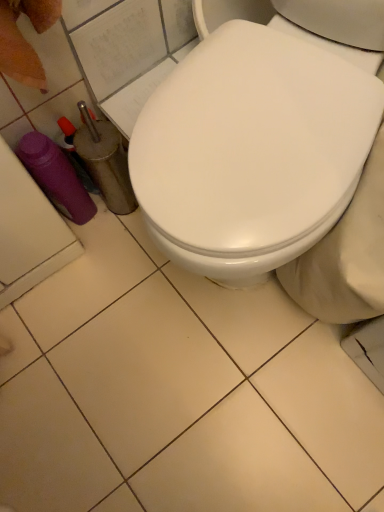
Locate an element on the screen. white glossy toilet at center is located at coordinates (251, 150).

Between white glossy toilet seat at center and white glossy toilet at center, which one appears on the left side from the viewer's perspective?

white glossy toilet at center is more to the left.

Can you confirm if white glossy toilet seat at center is shorter than white glossy toilet at center?

Yes.

What's the angular difference between white glossy toilet seat at center and white glossy toilet at center's facing directions?

There is a 0.000155-degree angle between the facing directions of white glossy toilet seat at center and white glossy toilet at center.

From a real-world perspective, is white glossy toilet seat at center over white glossy toilet at center?

No, from a real-world perspective, white glossy toilet seat at center is not on top of white glossy toilet at center.

Considering the relative sizes of white glossy toilet at center and purple plastic bottle at lower left in the image provided, is white glossy toilet at center bigger than purple plastic bottle at lower left?

Correct, white glossy toilet at center is larger in size than purple plastic bottle at lower left.

How many degrees apart are the facing directions of white glossy toilet at center and purple plastic bottle at lower left?

There is a 65.6-degree angle between the facing directions of white glossy toilet at center and purple plastic bottle at lower left.

Considering the sizes of objects white glossy toilet at center and purple plastic bottle at lower left in the image provided, who is thinner, white glossy toilet at center or purple plastic bottle at lower left?

With smaller width is purple plastic bottle at lower left.

Is purple plastic bottle at lower left located within white glossy toilet at center?

No, purple plastic bottle at lower left is not inside white glossy toilet at center.

Locate an element on the screen. This screenshot has width=384, height=512. bidet above the purple plastic bottle at lower left (from a real-world perspective) is located at coordinates 346,256.

Considering the points (60, 172) and (371, 281), which point is in front, point (60, 172) or point (371, 281)?

The point (371, 281) is more forward.

Is purple plastic bottle at lower left closer to camera compared to white glossy toilet seat at center?

No, purple plastic bottle at lower left is further to the viewer.

What's the angular difference between purple plastic bottle at lower left and white glossy toilet seat at center's facing directions?

65.6 degrees.

Is white glossy toilet seat at center beside purple plastic bottle at lower left?

No, white glossy toilet seat at center is not touching purple plastic bottle at lower left.

Can you tell me how much white glossy toilet seat at center and purple plastic bottle at lower left differ in facing direction?

white glossy toilet seat at center and purple plastic bottle at lower left are facing 65.6 degrees away from each other.

From a real-world perspective, who is located lower, white glossy toilet seat at center or purple plastic bottle at lower left?

From a 3D spatial view, purple plastic bottle at lower left is below.

How distant is white glossy toilet seat at center from purple plastic bottle at lower left?

white glossy toilet seat at center is 23.27 inches from purple plastic bottle at lower left.

Is purple plastic bottle at lower left bigger or smaller than white glossy toilet at center?

purple plastic bottle at lower left is smaller than white glossy toilet at center.

Between purple plastic bottle at lower left and white glossy toilet at center, which one has smaller width?

With smaller width is purple plastic bottle at lower left.

From the image's perspective, who appears lower, purple plastic bottle at lower left or white glossy toilet at center?

From the image's view, purple plastic bottle at lower left is below.

Which object is further away from the camera taking this photo, purple plastic bottle at lower left or white glossy toilet at center?

purple plastic bottle at lower left is further from the camera.

What's the angular difference between white glossy toilet at center and white glossy toilet seat at center's facing directions?

There is a 0.000155-degree angle between the facing directions of white glossy toilet at center and white glossy toilet seat at center.

Is white glossy toilet at center facing towards white glossy toilet seat at center?

No, white glossy toilet at center does not turn towards white glossy toilet seat at center.

Is white glossy toilet at center situated inside white glossy toilet seat at center or outside?

white glossy toilet at center exists outside the volume of white glossy toilet seat at center.

Does white glossy toilet at center touch white glossy toilet seat at center?

white glossy toilet at center and white glossy toilet seat at center are clearly separated.

Locate an element on the screen. This screenshot has width=384, height=512. bidet behind the white glossy toilet at center is located at coordinates (346, 256).

The width and height of the screenshot is (384, 512). I want to click on toilet located on the right of purple plastic bottle at lower left, so click(x=251, y=150).

From the image, which object appears to be nearer to white glossy toilet seat at center, purple plastic bottle at lower left or white glossy toilet at center?

Based on the image, white glossy toilet at center appears to be nearer to white glossy toilet seat at center.

When comparing their distances from white glossy toilet at center, does white glossy toilet seat at center or purple plastic bottle at lower left seem closer?

Among the two, white glossy toilet seat at center is located nearer to white glossy toilet at center.

Which object lies further to the anchor point purple plastic bottle at lower left, white glossy toilet seat at center or white glossy toilet at center?

Among the two, white glossy toilet seat at center is located further to purple plastic bottle at lower left.

Based on their spatial positions, is white glossy toilet at center or purple plastic bottle at lower left closer to white glossy toilet seat at center?

Among the two, white glossy toilet at center is located nearer to white glossy toilet seat at center.

Based on their spatial positions, is purple plastic bottle at lower left or white glossy toilet seat at center further from white glossy toilet at center?

purple plastic bottle at lower left.

Based on their spatial positions, is white glossy toilet at center or white glossy toilet seat at center further from purple plastic bottle at lower left?

The object further to purple plastic bottle at lower left is white glossy toilet seat at center.

Identify the location of toilet between purple plastic bottle at lower left and white glossy toilet seat at center from left to right. (251, 150).